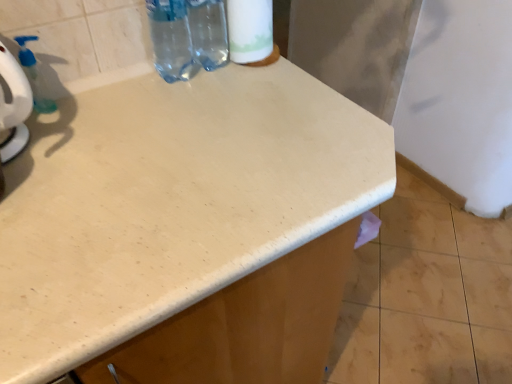
Find the location of `vacant area that lies between transparent plastic bottle at upper center, which is the second bottle in right-to-left order, and transparent plastic soap dispenser at upper left`. vacant area that lies between transparent plastic bottle at upper center, which is the second bottle in right-to-left order, and transparent plastic soap dispenser at upper left is located at coordinates [112, 94].